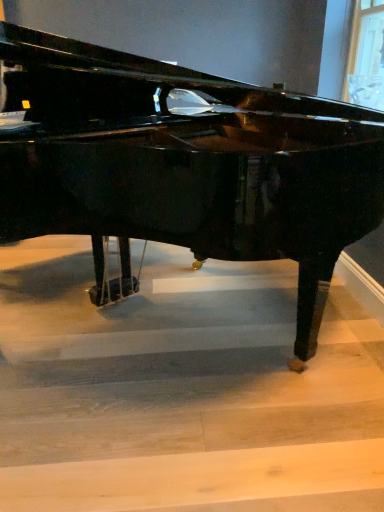
Question: In terms of height, does glossy black piano at center look taller or shorter compared to wooden stairwell at center?

Choices:
 (A) tall
 (B) short

Answer: (A)

Question: Is point (41, 172) closer or farther from the camera than point (210, 282)?

Choices:
 (A) farther
 (B) closer

Answer: (B)

Question: From a real-world perspective, relative to wooden stairwell at center, is glossy black piano at center vertically above or below?

Choices:
 (A) above
 (B) below

Answer: (A)

Question: Is wooden stairwell at center to the left or to the right of glossy black piano at center in the image?

Choices:
 (A) right
 (B) left

Answer: (A)

Question: In the image, is wooden stairwell at center positioned in front of or behind glossy black piano at center?

Choices:
 (A) behind
 (B) front

Answer: (A)

Question: Considering the positions of wooden stairwell at center and glossy black piano at center in the image, is wooden stairwell at center bigger or smaller than glossy black piano at center?

Choices:
 (A) small
 (B) big

Answer: (A)

Question: Does point (354, 312) appear closer or farther from the camera than point (100, 81)?

Choices:
 (A) farther
 (B) closer

Answer: (A)